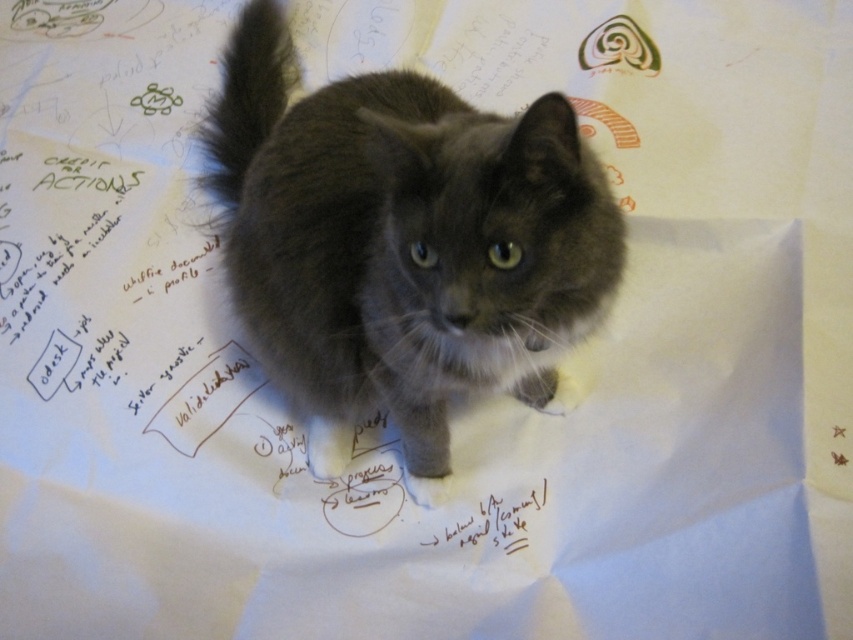
Who is positioned more to the left, gray fluffy cat at center or gray fluffy tail at upper center?

gray fluffy tail at upper center is more to the left.

Is point (599, 164) positioned in front of point (282, 77)?

Yes.

Between point (393, 232) and point (289, 51), which one is positioned behind?

Positioned behind is point (289, 51).

At what (x,y) coordinates should I click in order to perform the action: click on gray fluffy cat at center. Please return your answer as a coordinate pair (x, y). The height and width of the screenshot is (640, 853). Looking at the image, I should click on (401, 241).

Is gray fluffy cat at center positioned in front of black paper at center?

Yes, it is.

Can you confirm if gray fluffy cat at center is thinner than black paper at center?

In fact, gray fluffy cat at center might be wider than black paper at center.

Who is more distant from viewer, (480,317) or (502,525)?

The point (502,525) is behind.

Find the location of `gray fluffy cat at center`. gray fluffy cat at center is located at coordinates (401, 241).

Between gray fluffy tail at upper center and black paper at center, which one has more height?

gray fluffy tail at upper center

Is gray fluffy tail at upper center thinner than black paper at center?

Yes, gray fluffy tail at upper center is thinner than black paper at center.

Which is in front, point (223, 83) or point (531, 515)?

Point (531, 515) is in front.

Where is `gray fluffy tail at upper center`? gray fluffy tail at upper center is located at coordinates (247, 99).